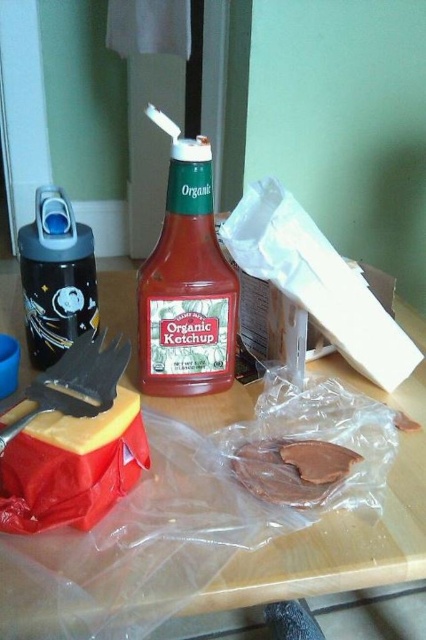
Question: Considering the relative positions of brown matte chocolate at center and yellow cheese at lower left in the image provided, where is brown matte chocolate at center located with respect to yellow cheese at lower left?

Choices:
 (A) left
 (B) right

Answer: (B)

Question: Which point is farther from the camera taking this photo?

Choices:
 (A) (239, 636)
 (B) (342, 448)

Answer: (A)

Question: Is black matte water bottle at left below brown matte chocolate at center?

Choices:
 (A) yes
 (B) no

Answer: (B)

Question: Among these points, which one is farthest from the camera?

Choices:
 (A) (210, 259)
 (B) (6, 273)
 (C) (91, 244)
 (D) (85, 444)

Answer: (B)

Question: Which of the following is the farthest from the observer?

Choices:
 (A) black matte water bottle at left
 (B) wooden table at center

Answer: (A)

Question: Does wooden table at center have a greater width compared to yellow cheese at lower left?

Choices:
 (A) yes
 (B) no

Answer: (A)